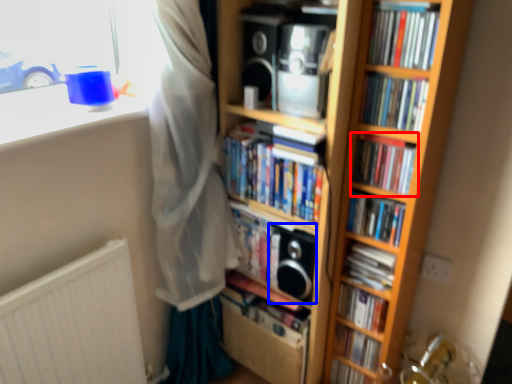
Question: Which point is closer to the camera, book (highlighted by a red box) or speaker (highlighted by a blue box)?

Choices:
 (A) book
 (B) speaker

Answer: (A)